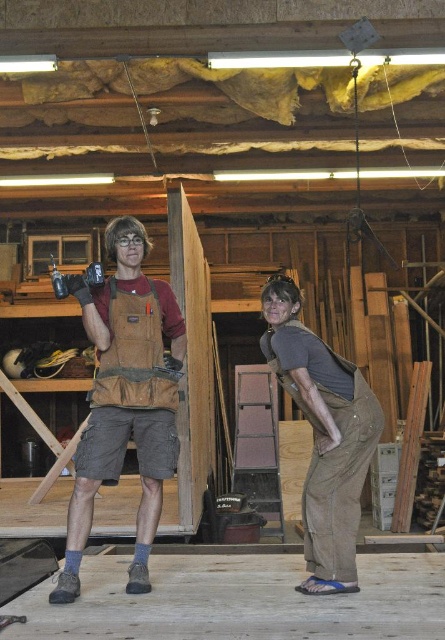
What is the location of the point with coordinates (125, 397) in the image?

The point with coordinates (125, 397) is located on the brown canvas tool vest at center.